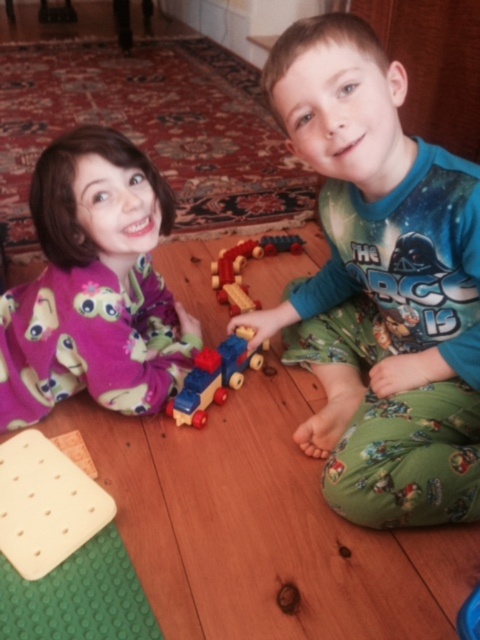
Is green cotton pajamas at center wider than wooden train at center?

Yes.

Which is in front, point (435, 516) or point (216, 360)?

Point (435, 516) is more forward.

What do you see at coordinates (381, 285) in the screenshot?
I see `green cotton pajamas at center` at bounding box center [381, 285].

Where is `green cotton pajamas at center`? green cotton pajamas at center is located at coordinates (381, 285).

From the picture: Between green cotton pajamas at center and matte purple pajamas at left, which one appears on the left side from the viewer's perspective?

matte purple pajamas at left

Which of these two, green cotton pajamas at center or matte purple pajamas at left, stands taller?

green cotton pajamas at center is taller.

Who is more distant from viewer, (335, 342) or (193, 349)?

Point (335, 342)

Locate an element on the screen. green cotton pajamas at center is located at coordinates (381, 285).

Which is more to the right, matte purple pajamas at left or wooden train at center?

wooden train at center is more to the right.

Does matte purple pajamas at left lie behind wooden train at center?

No, it is in front of wooden train at center.

Is point (109, 374) closer to camera compared to point (200, 362)?

Yes.

Where is `matte purple pajamas at left`? matte purple pajamas at left is located at coordinates (94, 285).